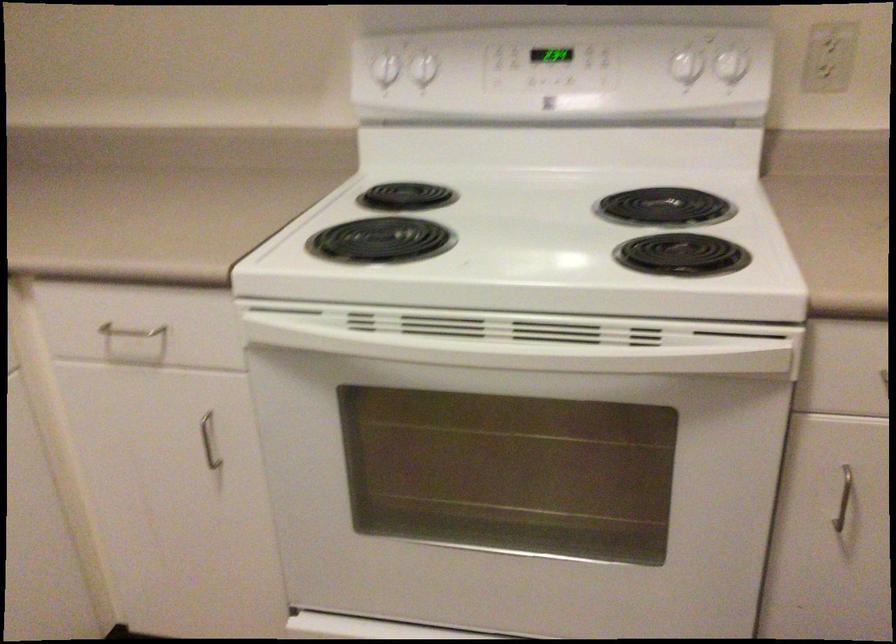
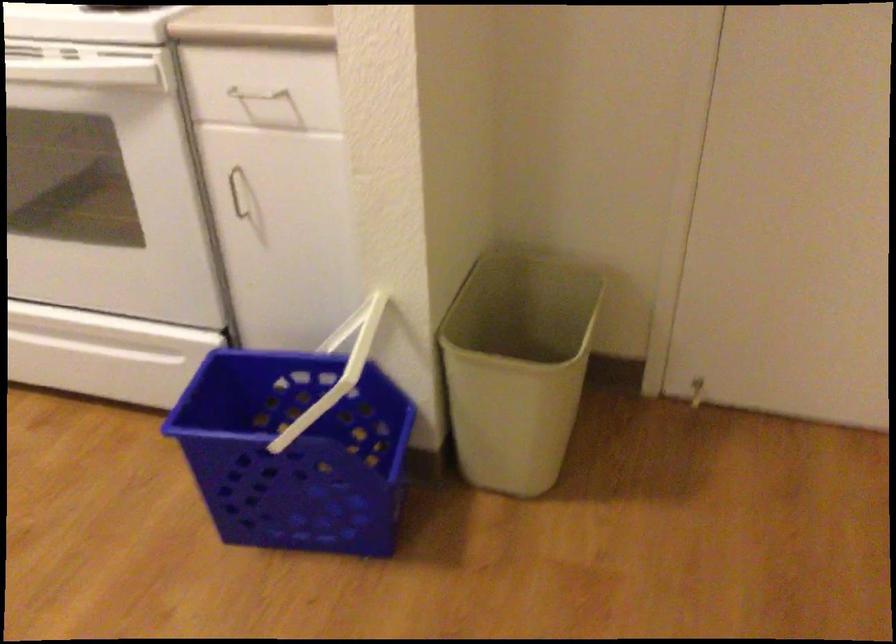
Locate, in the second image, the point that corresponds to pixel 617 482 in the first image.

(104, 185)